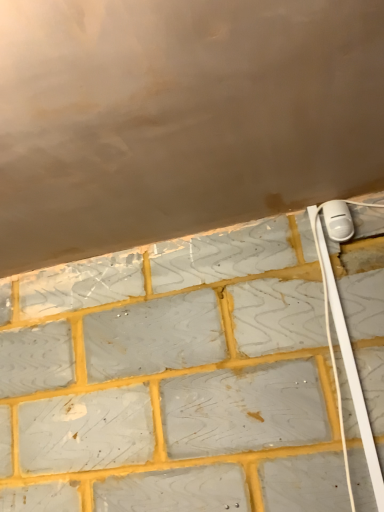
Question: Considering the relative positions of white plastic power plug at upper right and white plastic cable at right in the image provided, is white plastic power plug at upper right to the left or to the right of white plastic cable at right?

Choices:
 (A) right
 (B) left

Answer: (A)

Question: Looking at their shapes, would you say white plastic power plug at upper right is wider or thinner than white plastic cable at right?

Choices:
 (A) wide
 (B) thin

Answer: (A)

Question: Is white plastic power plug at upper right in front of or behind white plastic cable at right in the image?

Choices:
 (A) behind
 (B) front

Answer: (A)

Question: From the image's perspective, is white plastic cable at right located above or below white plastic power plug at upper right?

Choices:
 (A) above
 (B) below

Answer: (B)

Question: Considering the positions of point (360, 391) and point (339, 205), is point (360, 391) closer or farther from the camera than point (339, 205)?

Choices:
 (A) farther
 (B) closer

Answer: (B)

Question: In the image, is white plastic cable at right positioned in front of or behind white plastic power plug at upper right?

Choices:
 (A) behind
 (B) front

Answer: (B)

Question: Choose the correct answer: Is white plastic cable at right inside white plastic power plug at upper right or outside it?

Choices:
 (A) outside
 (B) inside

Answer: (A)